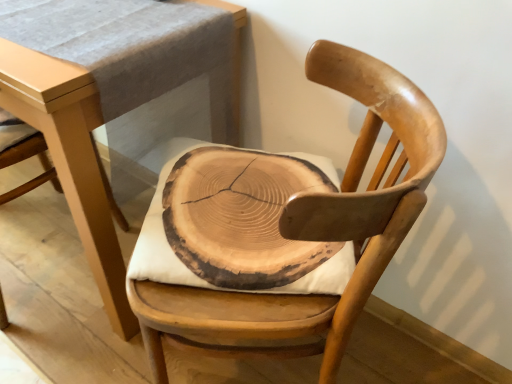
Question: Could you tell me if wooden slice cushion at center is turned towards light brown wood table at center?

Choices:
 (A) no
 (B) yes

Answer: (B)

Question: Is wooden slice cushion at center next to light brown wood table at center?

Choices:
 (A) yes
 (B) no

Answer: (B)

Question: From a real-world perspective, is wooden slice cushion at center physically above light brown wood table at center?

Choices:
 (A) no
 (B) yes

Answer: (B)

Question: Is wooden slice cushion at center located outside light brown wood table at center?

Choices:
 (A) no
 (B) yes

Answer: (B)

Question: From a real-world perspective, is wooden slice cushion at center below light brown wood table at center?

Choices:
 (A) no
 (B) yes

Answer: (A)

Question: Is wooden slice cushion at center in front of or behind natural wood chair at center in the image?

Choices:
 (A) behind
 (B) front

Answer: (A)

Question: From a real-world perspective, relative to natural wood chair at center, is wooden slice cushion at center vertically above or below?

Choices:
 (A) below
 (B) above

Answer: (B)

Question: From the image's perspective, relative to natural wood chair at center, is wooden slice cushion at center above or below?

Choices:
 (A) above
 (B) below

Answer: (A)

Question: Considering the positions of point [203, 268] and point [378, 226], is point [203, 268] closer or farther from the camera than point [378, 226]?

Choices:
 (A) farther
 (B) closer

Answer: (A)

Question: Considering the positions of light brown wood table at center and natural wood chair at center in the image, is light brown wood table at center wider or thinner than natural wood chair at center?

Choices:
 (A) wide
 (B) thin

Answer: (A)

Question: From the image's perspective, relative to natural wood chair at center, is light brown wood table at center above or below?

Choices:
 (A) above
 (B) below

Answer: (A)

Question: From a real-world perspective, relative to natural wood chair at center, is light brown wood table at center vertically above or below?

Choices:
 (A) above
 (B) below

Answer: (B)

Question: Would you say light brown wood table at center is inside or outside natural wood chair at center?

Choices:
 (A) inside
 (B) outside

Answer: (B)

Question: Would you say wooden slice cushion at center is to the left or to the right of light brown wood table at center in the picture?

Choices:
 (A) left
 (B) right

Answer: (B)

Question: From a real-world perspective, is wooden slice cushion at center physically located above or below light brown wood table at center?

Choices:
 (A) below
 (B) above

Answer: (B)